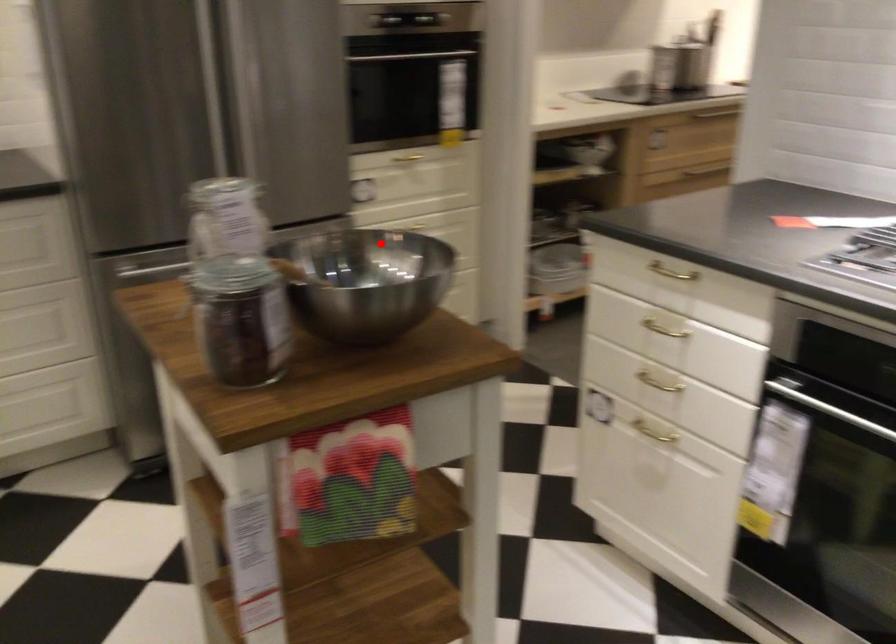
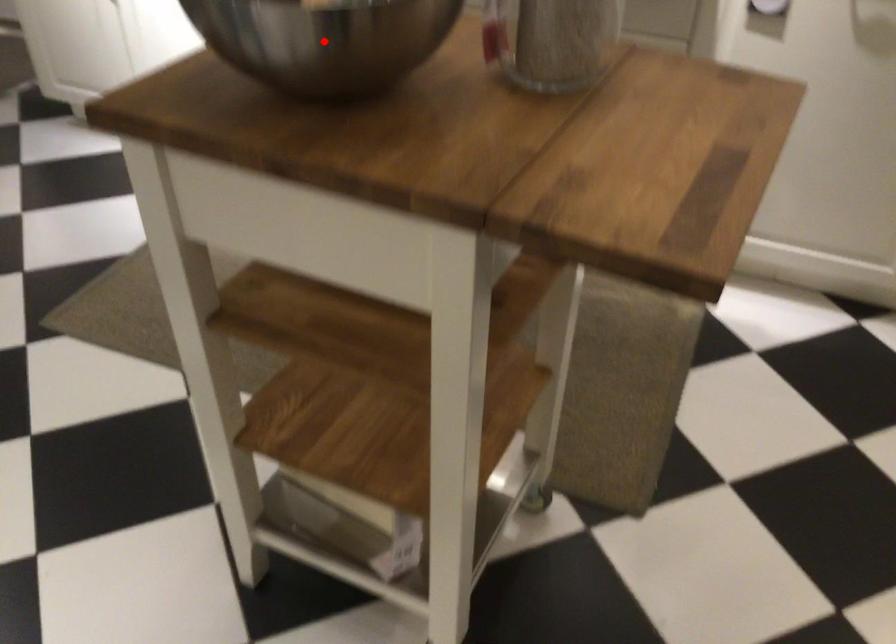
I am providing you with two images of the same scene from different viewpoints. A red point is marked on the first image and another point is marked on the second image. Is the red point in image1 aligned with the point shown in image2?

Yes